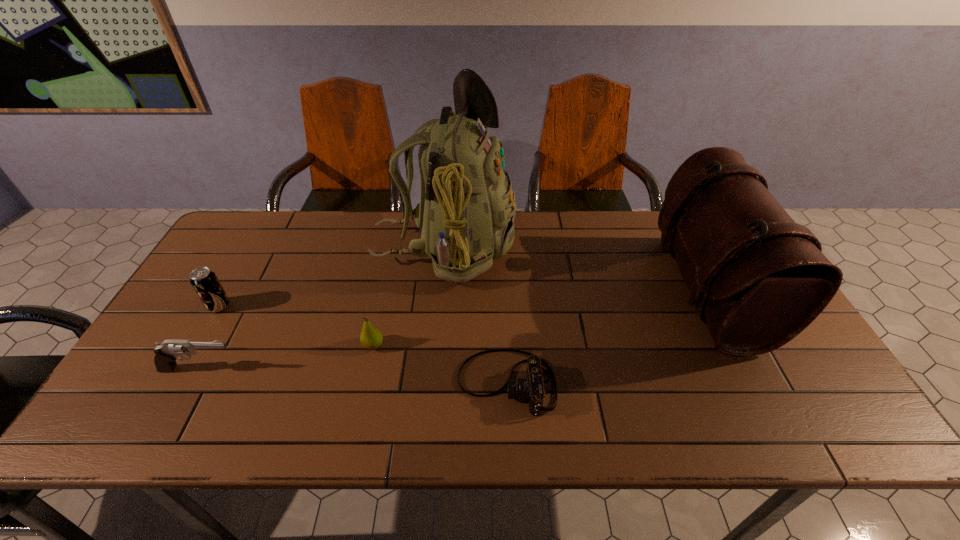
Locate an element on the screen. soda can that is at the left edge is located at coordinates (204, 281).

Where is `gun positioned at the left edge`? This screenshot has height=540, width=960. gun positioned at the left edge is located at coordinates 166,353.

At what (x,y) coordinates should I click in order to perform the action: click on object present at the right edge. Please return your answer as a coordinate pair (x, y). The width and height of the screenshot is (960, 540). Looking at the image, I should click on 758,279.

This screenshot has width=960, height=540. What are the coordinates of `object that is at the far right corner` in the screenshot? It's located at tap(758, 279).

Image resolution: width=960 pixels, height=540 pixels. In the image, there is a desktop. What are the coordinates of `vacant area at the far edge` in the screenshot? It's located at (639, 214).

Image resolution: width=960 pixels, height=540 pixels. I want to click on free region at the near edge of the desktop, so click(x=226, y=423).

The height and width of the screenshot is (540, 960). In order to click on free space at the far left corner in this screenshot , I will do `click(252, 214)`.

Where is `blank region between the soda can and the tallest object`? Image resolution: width=960 pixels, height=540 pixels. blank region between the soda can and the tallest object is located at coordinates (331, 277).

The height and width of the screenshot is (540, 960). What are the coordinates of `free space between the pear and the gun` in the screenshot? It's located at (287, 357).

What are the coordinates of `free space between the fifth shortest object and the camera` in the screenshot? It's located at pos(607,336).